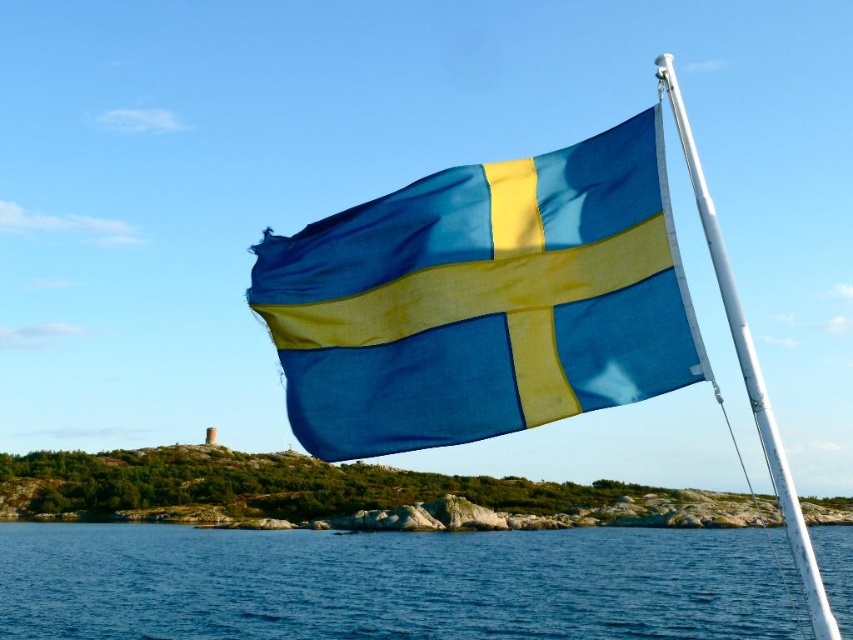
Question: Which object is positioned closest to the blue water at lower left?

Choices:
 (A) white metallic pole at upper right
 (B) blue fabric flag at upper right

Answer: (A)

Question: Is blue fabric flag at upper right to the right of white metallic pole at upper right from the viewer's perspective?

Choices:
 (A) yes
 (B) no

Answer: (B)

Question: Can you confirm if blue water at lower left is thinner than white metallic pole at upper right?

Choices:
 (A) yes
 (B) no

Answer: (B)

Question: Does blue water at lower left have a lesser width compared to white metallic pole at upper right?

Choices:
 (A) yes
 (B) no

Answer: (B)

Question: Which object is positioned farthest from the blue water at lower left?

Choices:
 (A) white metallic pole at upper right
 (B) blue fabric flag at upper right

Answer: (B)

Question: Which object is the farthest from the blue fabric flag at upper right?

Choices:
 (A) white metallic pole at upper right
 (B) blue water at lower left

Answer: (B)